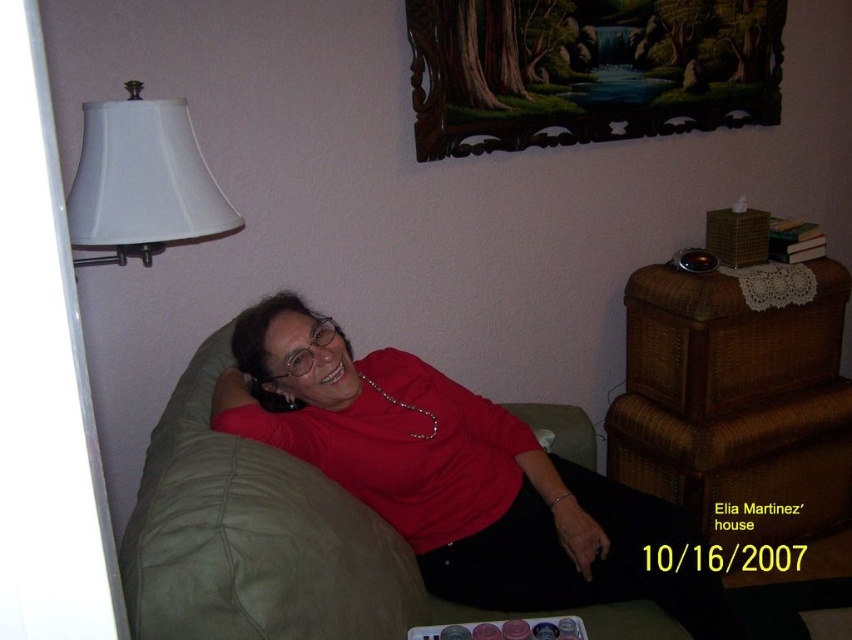
Can you confirm if matte red blouse at center is bigger than silver metallic necklace at center?

Correct, matte red blouse at center is larger in size than silver metallic necklace at center.

Does matte red blouse at center lie behind silver metallic necklace at center?

No, matte red blouse at center is closer to the viewer.

Describe the element at coordinates (468, 481) in the screenshot. The width and height of the screenshot is (852, 640). I see `matte red blouse at center` at that location.

This screenshot has width=852, height=640. I want to click on matte red blouse at center, so click(468, 481).

Is white fabric lampshade at upper left bigger than silver metallic necklace at center?

Yes.

Does white fabric lampshade at upper left appear over silver metallic necklace at center?

Correct, white fabric lampshade at upper left is located above silver metallic necklace at center.

Locate an element on the screen. Image resolution: width=852 pixels, height=640 pixels. white fabric lampshade at upper left is located at coordinates (141, 180).

Between dark wood picture frame at upper center and silver metallic necklace at center, which one appears on the left side from the viewer's perspective?

silver metallic necklace at center

I want to click on dark wood picture frame at upper center, so click(x=586, y=68).

Image resolution: width=852 pixels, height=640 pixels. Identify the location of dark wood picture frame at upper center. pos(586,68).